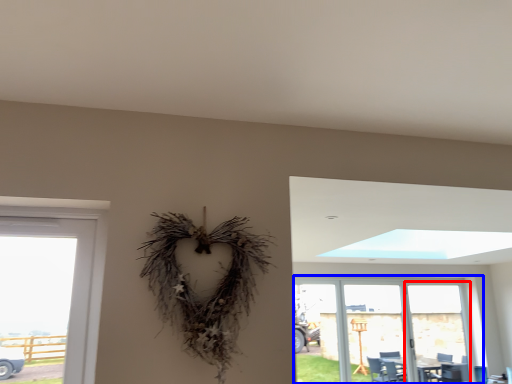
Question: Which object appears closest to the camera in this image, screen door (highlighted by a red box) or window (highlighted by a blue box)?

Choices:
 (A) screen door
 (B) window

Answer: (B)